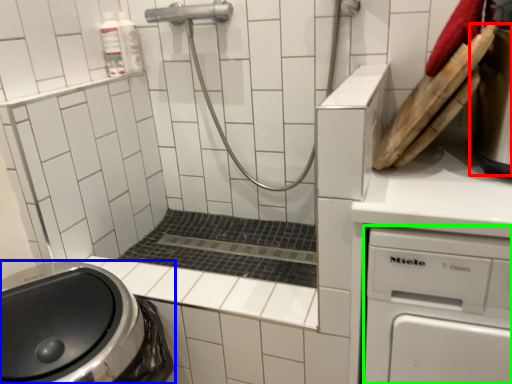
Question: Which object is positioned closest to appliance (highlighted by a red box)? Select from washing machine (highlighted by a blue box) and dish washer (highlighted by a green box).

Choices:
 (A) washing machine
 (B) dish washer

Answer: (B)